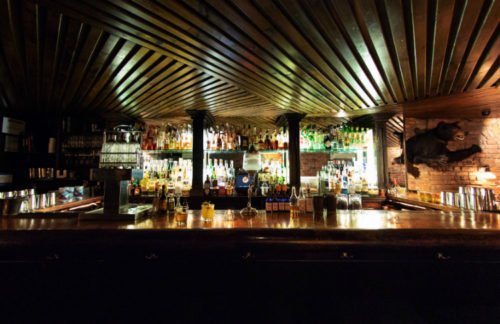
Identify the location of bottles. (245, 166).